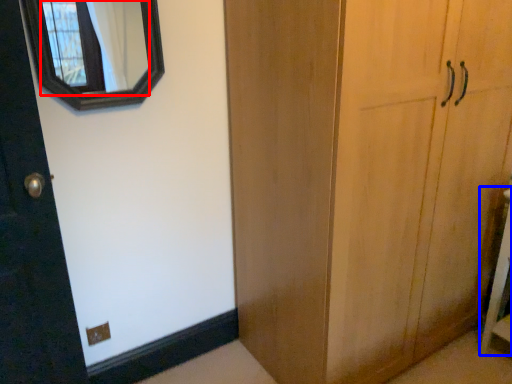
Question: Which point is closer to the camera, mirror (highlighted by a red box) or vanity (highlighted by a blue box)?

Choices:
 (A) mirror
 (B) vanity

Answer: (A)